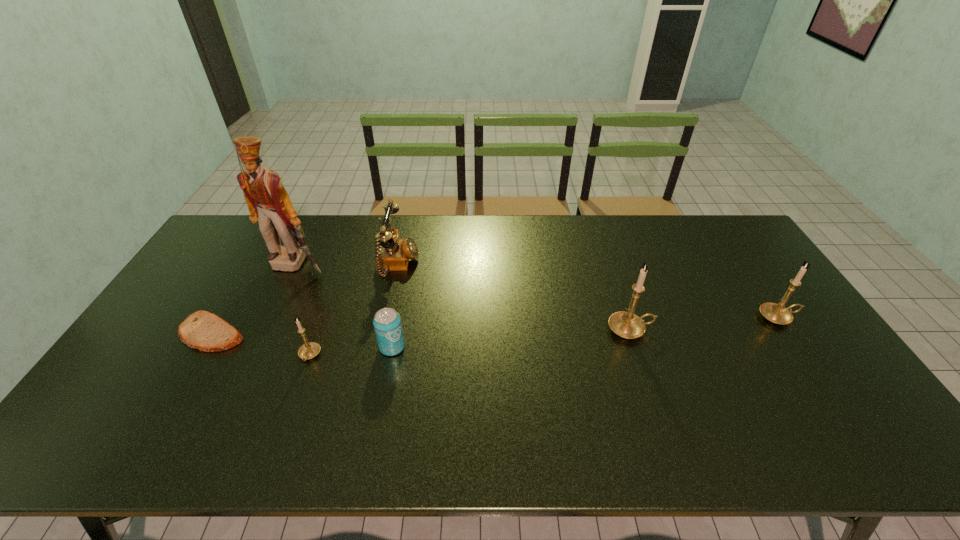
The height and width of the screenshot is (540, 960). Identify the location of free space located on the handle side of the sixth object from left to right. (719, 329).

Find the location of a particular element. This screenshot has height=540, width=960. free region located 0.350m on the front-facing side of the tallest object is located at coordinates (250, 364).

Locate an element on the screen. Image resolution: width=960 pixels, height=540 pixels. free space located 0.270m on the back of the pita bread is located at coordinates (256, 258).

Find the location of `vacant space located on the dial number of the telephone`. vacant space located on the dial number of the telephone is located at coordinates (532, 265).

You are a GUI agent. You are given a task and a screenshot of the screen. Output one action in this format:
    pyautogui.click(x=<x>, y=<y>)
    Task: Click on the vacant region located 0.050m on the front of the beer can
    The width and height of the screenshot is (960, 540).
    Given the screenshot: What is the action you would take?
    pyautogui.click(x=388, y=373)

Locate an element on the screen. The image size is (960, 540). nutcracker situated at the far edge is located at coordinates (268, 202).

What are the coordinates of `telephone located at the far edge` in the screenshot? It's located at (393, 254).

Where is `object that is at the left edge`? object that is at the left edge is located at coordinates (202, 330).

In order to click on object at the right edge in this screenshot , I will do `click(776, 313)`.

The width and height of the screenshot is (960, 540). Find the location of `vacant space at the far edge`. vacant space at the far edge is located at coordinates (687, 236).